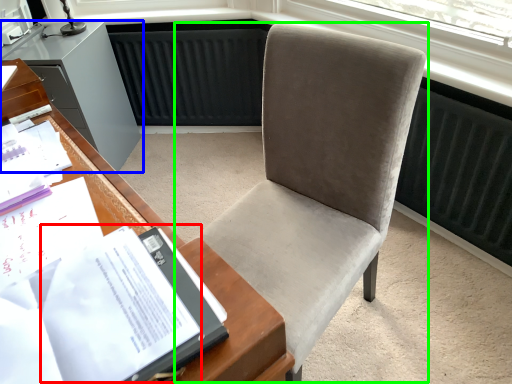
Question: Considering the real-world distances, which object is farthest from journal (highlighted by a red box)? cabinetry (highlighted by a blue box) or chair (highlighted by a green box)?

Choices:
 (A) cabinetry
 (B) chair

Answer: (A)